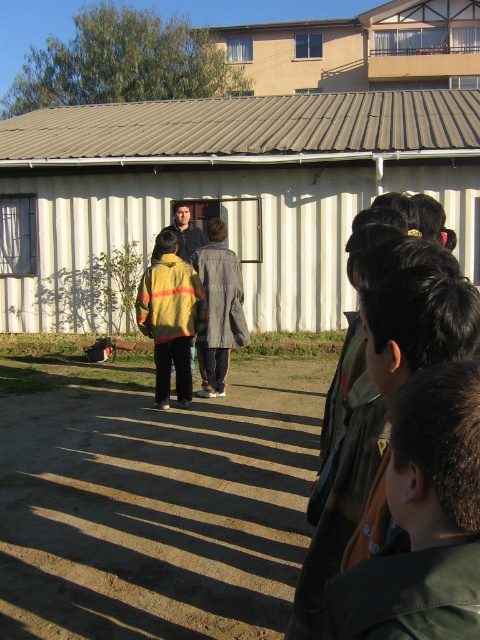
You are a photographer trying to capture a photo of the white corrugated metal shed at center without the yellow jacket at center blocking the view. Is it possible to take such a photo from your current position?

The white corrugated metal shed at center is located above the yellow jacket at center, so it is possible to take a photo of the white corrugated metal shed at center without the yellow jacket at center blocking the view by angling the camera upwards to focus on the higher position of the shed.

You are a photographer trying to capture a photo of the yellow jacket at center and the matte black jacket at center. Since you want both subjects to be in the frame, which jacket should you position first to ensure they are both visible?

You should position the matte black jacket at center first because the yellow jacket at center is to the right of it, so by centering the matte black jacket, the yellow jacket will naturally be included to its right in the frame.